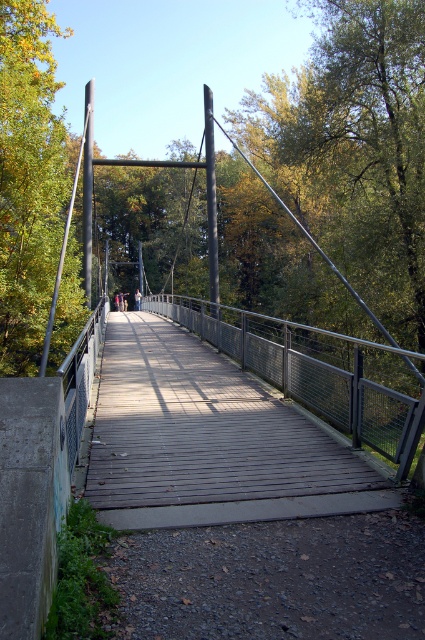
Is wooden planks at center wider than wooden bridge at center?

In fact, wooden planks at center might be narrower than wooden bridge at center.

Is wooden planks at center in front of wooden bridge at center?

Yes, wooden planks at center is closer to the viewer.

Where is `wooden planks at center`? This screenshot has width=425, height=640. wooden planks at center is located at coordinates (207, 440).

Identify the location of wooden planks at center. (207, 440).